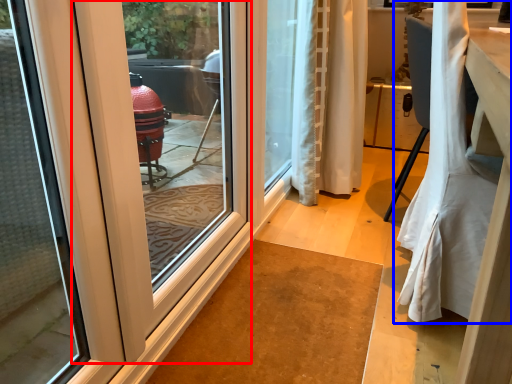
Question: Which object appears farthest to the camera in this image, door (highlighted by a red box) or curtain (highlighted by a blue box)?

Choices:
 (A) door
 (B) curtain

Answer: (B)